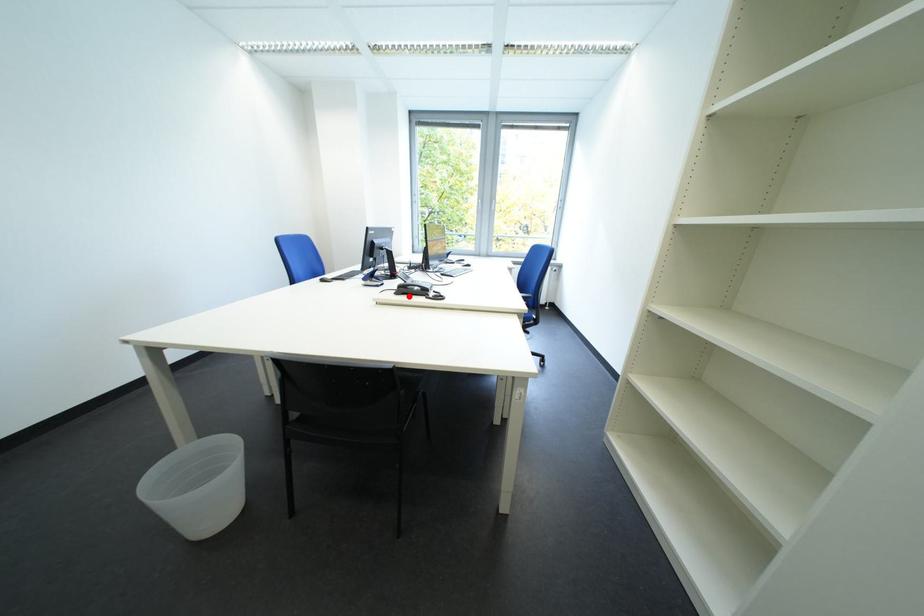
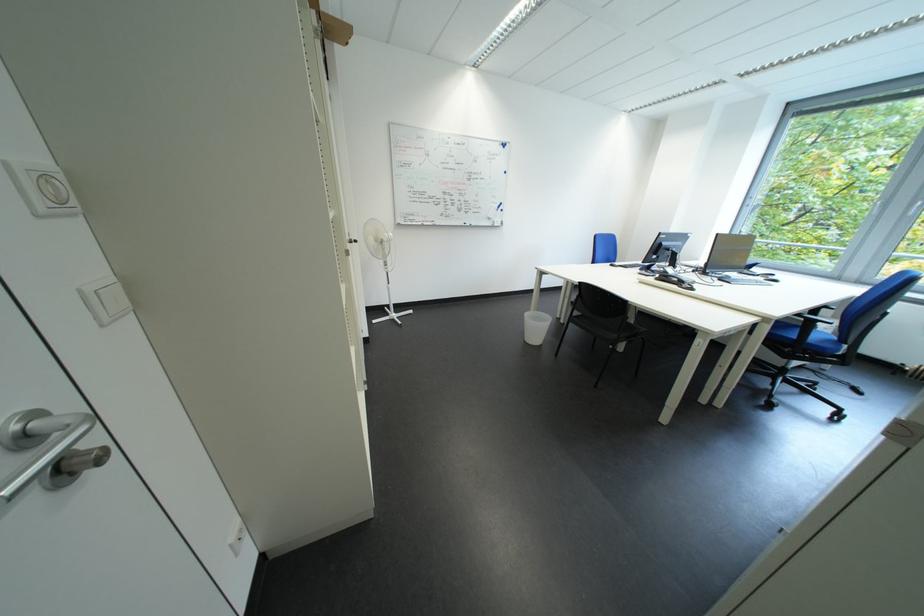
Locate, in the second image, the point that corresponds to the highlighted location in the first image.

(669, 282)